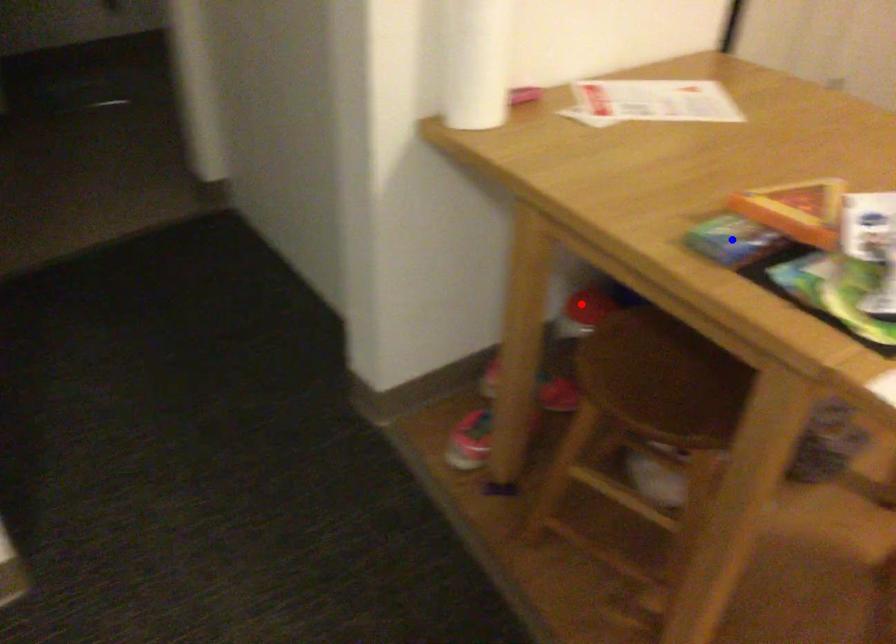
Question: Which of the two points in the image is closer to the camera?

Choices:
 (A) Blue point is closer.
 (B) Red point is closer.

Answer: (A)